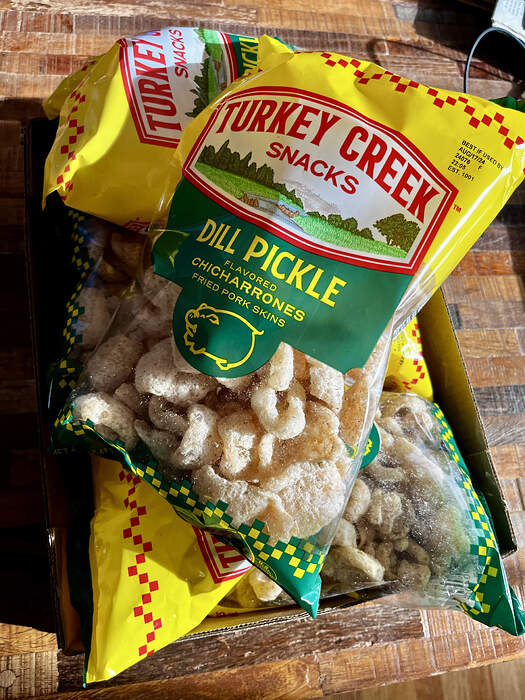
In order to click on wood board in this screenshot , I will do `click(381, 630)`.